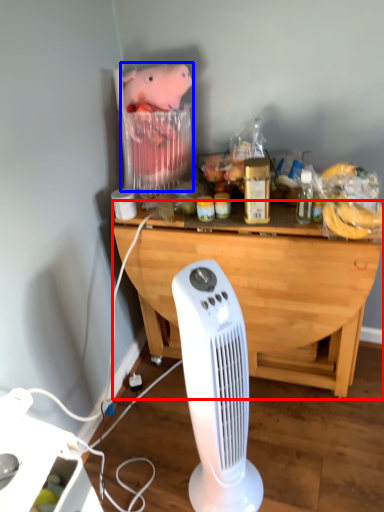
Question: Which point is closer to the camera, desk (highlighted by a red box) or animal (highlighted by a blue box)?

Choices:
 (A) desk
 (B) animal

Answer: (A)